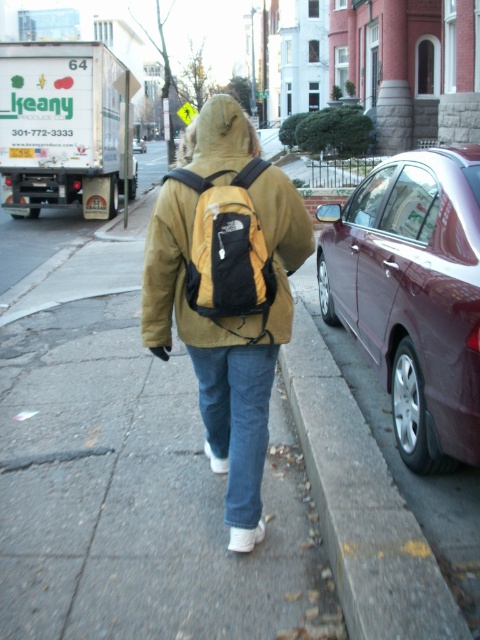
Can you confirm if denim jeans at lower center is taller than maroon metallic sedan at center?

No, denim jeans at lower center is not taller than maroon metallic sedan at center.

Between point (255, 352) and point (141, 138), which one is positioned behind?

Positioned behind is point (141, 138).

Is point (260, 396) in front of point (140, 145)?

Yes, it is in front of point (140, 145).

Locate an element on the screen. This screenshot has width=480, height=640. denim jeans at lower center is located at coordinates (237, 419).

Which is below, concrete at lower right or denim jeans at lower center?

concrete at lower right is below.

Can you confirm if concrete at lower right is positioned to the right of denim jeans at lower center?

Indeed, concrete at lower right is positioned on the right side of denim jeans at lower center.

Does point (429, 604) come closer to viewer compared to point (252, 410)?

Yes, it is.

Identify the location of concrete at lower right. (361, 506).

Does yellow matte backpack at center appear on the left side of denim jeans at lower center?

No, yellow matte backpack at center is not to the left of denim jeans at lower center.

Is yellow matte backpack at center above denim jeans at lower center?

Indeed, yellow matte backpack at center is positioned over denim jeans at lower center.

Who is more distant from viewer, (x=251, y=337) or (x=239, y=433)?

Point (x=239, y=433)

The width and height of the screenshot is (480, 640). Find the location of `yellow matte backpack at center`. yellow matte backpack at center is located at coordinates (228, 250).